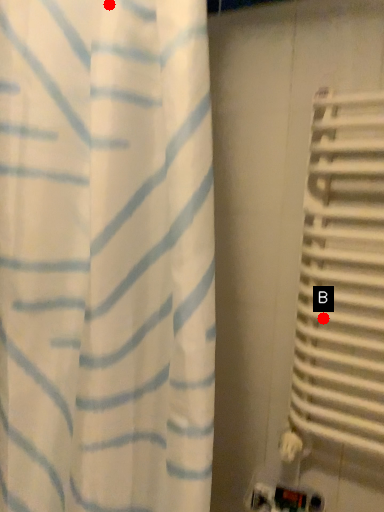
Question: Two points are circled on the image, labeled by A and B beside each circle. Which point is farther from the camera taking this photo?

Choices:
 (A) A is further
 (B) B is further

Answer: (B)